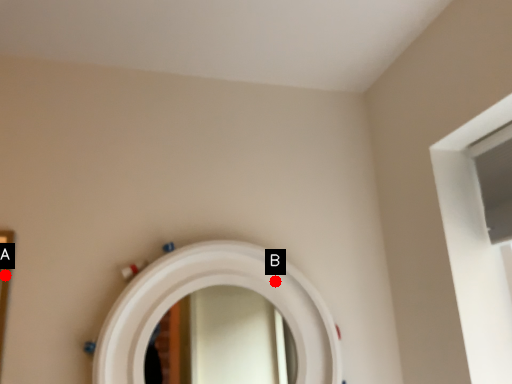
Question: Two points are circled on the image, labeled by A and B beside each circle. Which of the following is the closest to the observer?

Choices:
 (A) A is closer
 (B) B is closer

Answer: (A)